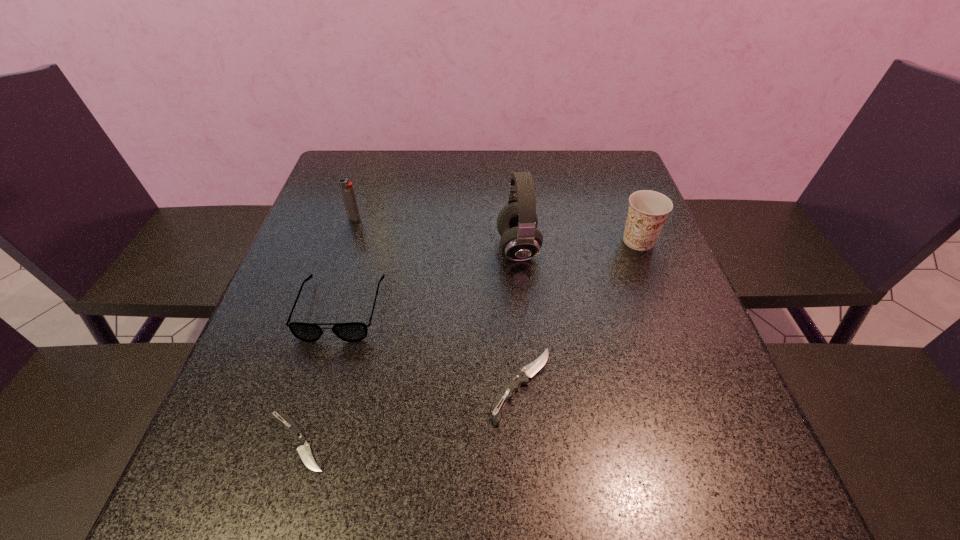
In order to click on free point that keeps the pocketknifes evenly spaced on the right in this screenshot , I will do `click(708, 338)`.